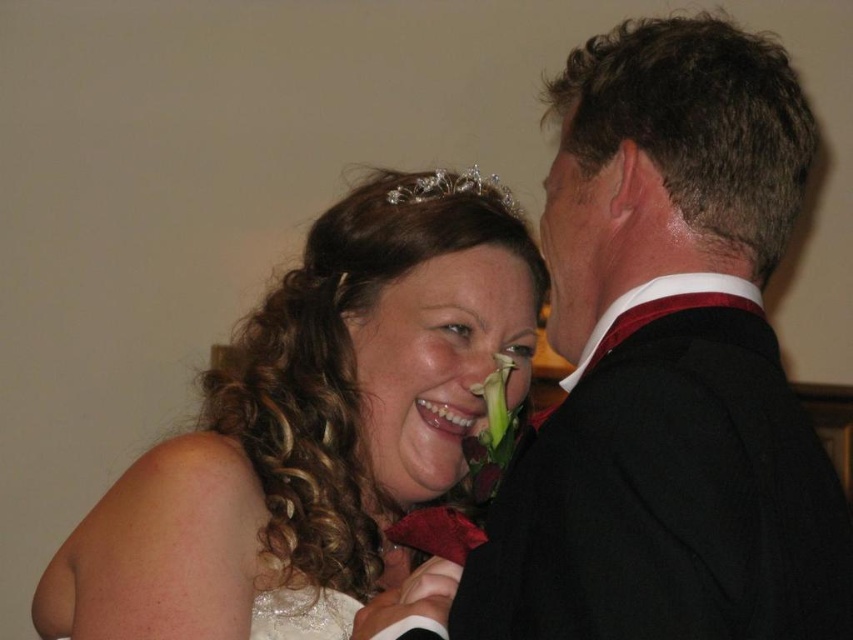
Is point (776, 435) less distant than point (450, 179)?

Yes.

Between black satin suit at upper right and clear crystal tiara at upper center, which one appears on the left side from the viewer's perspective?

From the viewer's perspective, clear crystal tiara at upper center appears more on the left side.

The height and width of the screenshot is (640, 853). I want to click on black satin suit at upper right, so click(668, 364).

Does point (755, 280) lie in front of point (332, 637)?

Yes, point (755, 280) is in front of point (332, 637).

Where is `black satin suit at upper right`? black satin suit at upper right is located at coordinates (668, 364).

Where is `black satin suit at upper right`? The width and height of the screenshot is (853, 640). black satin suit at upper right is located at coordinates [668, 364].

Can you confirm if white lace dress at lower left is positioned below clear crystal tiara at upper center?

Yes.

Who is lower down, white lace dress at lower left or clear crystal tiara at upper center?

white lace dress at lower left is below.

Does point (323, 616) come in front of point (489, 186)?

That is True.

The width and height of the screenshot is (853, 640). In order to click on white lace dress at lower left in this screenshot , I will do pyautogui.click(x=302, y=614).